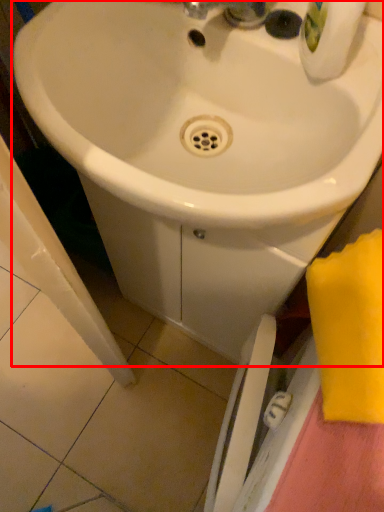
Question: From the image's perspective, what is the correct spatial positioning of sink (annotated by the red box) in reference to beach towel?

Choices:
 (A) above
 (B) below

Answer: (A)